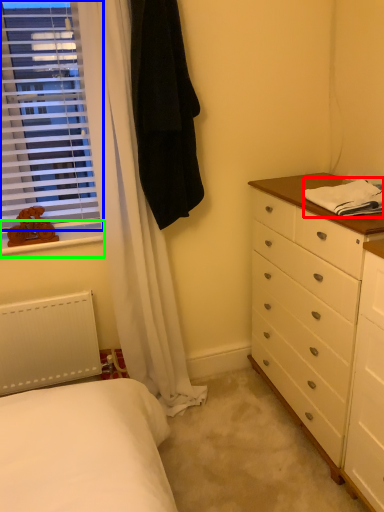
Question: Based on their relative distances, which object is nearer to blanket (highlighted by a red box)? Choose from window (highlighted by a blue box) and window sill (highlighted by a green box).

Choices:
 (A) window
 (B) window sill

Answer: (B)